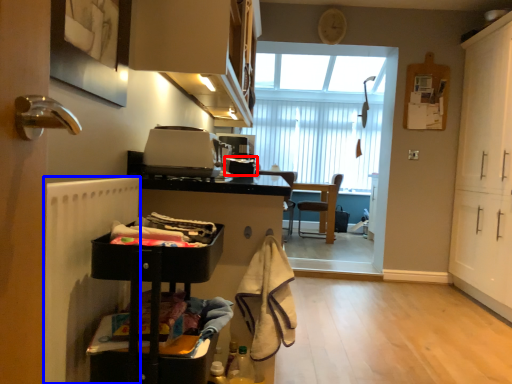
Question: Which object appears farthest to the camera in this image, appliance (highlighted by a red box) or radiator (highlighted by a blue box)?

Choices:
 (A) appliance
 (B) radiator

Answer: (A)